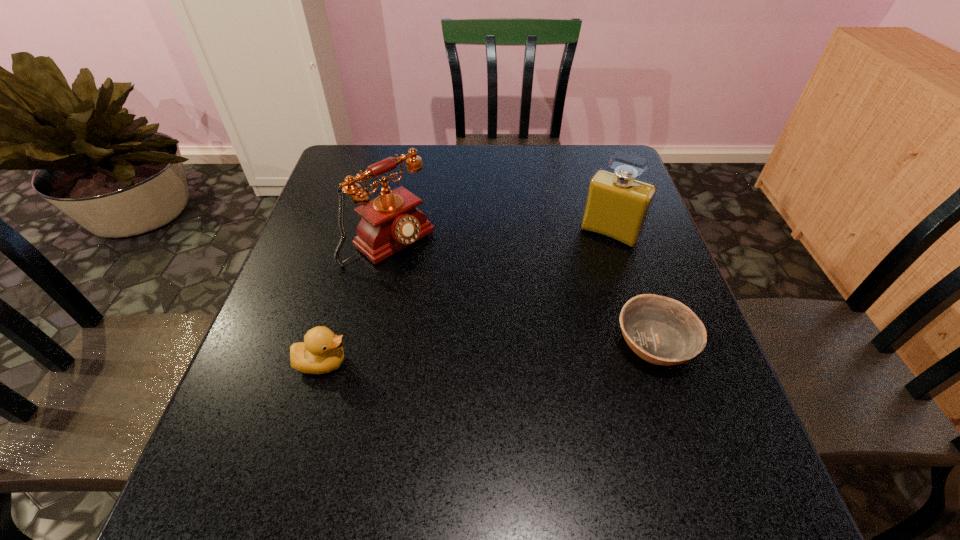
Identify the location of free space between the bowl and the second shortest object. [x=489, y=352].

Where is `vacant space that is in between the third tallest object and the telephone`? The height and width of the screenshot is (540, 960). vacant space that is in between the third tallest object and the telephone is located at coordinates (356, 302).

At what (x,y) coordinates should I click in order to perform the action: click on vacant point located between the shortest object and the perfume. Please return your answer as a coordinate pair (x, y). Image resolution: width=960 pixels, height=540 pixels. Looking at the image, I should click on (632, 288).

Locate which object ranks second in proximity to the bowl. Please provide its 2D coordinates. Your answer should be formatted as a tuple, i.e. [(x, y)], where the tuple contains the x and y coordinates of a point satisfying the conditions above.

[(390, 222)]

Identify which object is the second closest to the duckling. Please provide its 2D coordinates. Your answer should be formatted as a tuple, i.e. [(x, y)], where the tuple contains the x and y coordinates of a point satisfying the conditions above.

[(660, 330)]